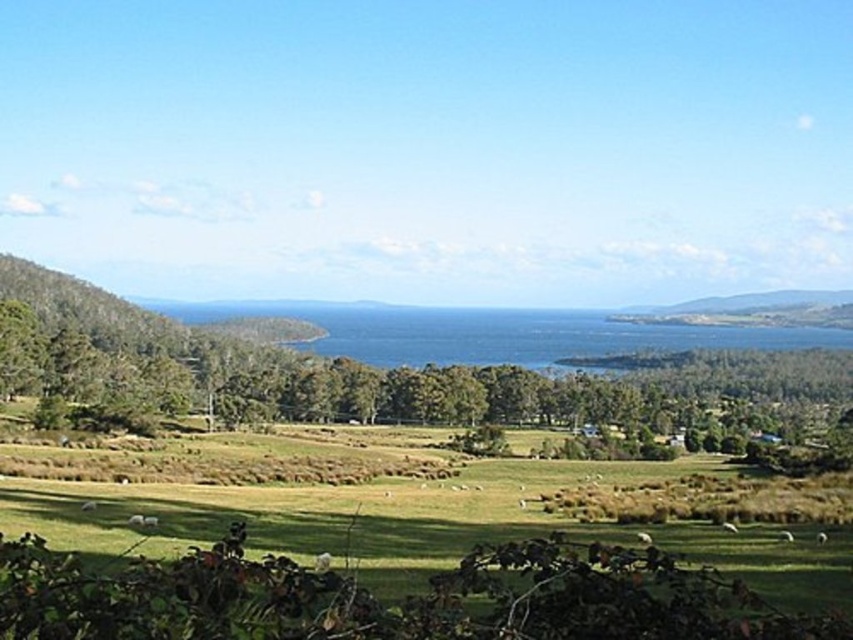
You are standing at the center of the field in the rural landscape. You want to walk to the green leafy tree at lower center. Which direction should you head towards?

The green leafy tree at lower center is located at point 0.595 on the x axis and 0.503 on the y axis. Since you are at the center of the field, which is point 0.5 on both axes, you should move slightly to the right and forward to reach it.

You are a hiker trying to decide between resting under the shade of the green leafy tree at lower center or sitting on the green grassy hillside at right. Which option provides more shade coverage?

The green leafy tree at lower center has a larger size compared to the green grassy hillside at right, so it provides more shade coverage.